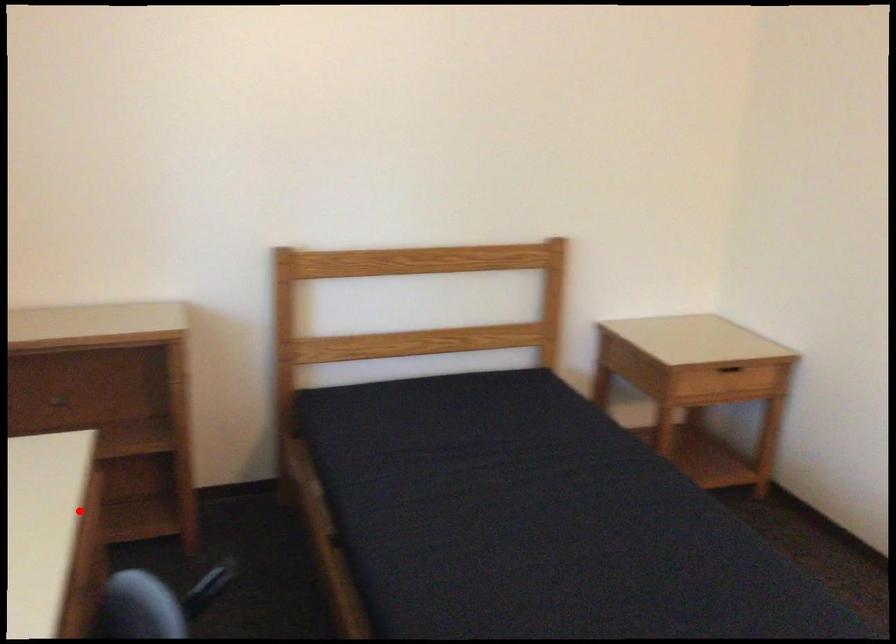
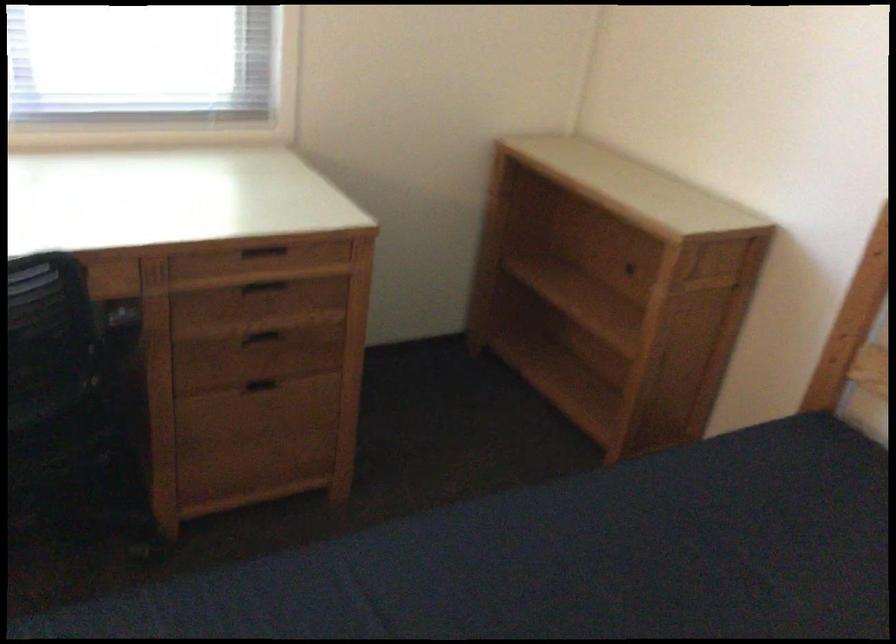
Question: A red point is marked in image1. In image2, is the corresponding 3D point closer to the camera or farther? Reply with the corresponding letter.

Choices:
 (A) The corresponding 3D point is closer.
 (B) The corresponding 3D point is farther.

Answer: (B)